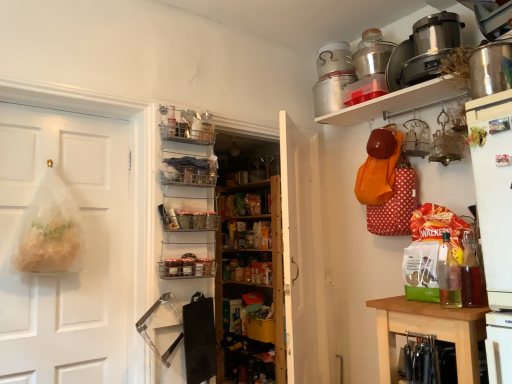
Locate an element on the screen. This screenshot has height=384, width=512. vacant space situated above metallic wire baskets at center, which is counted as the first shelf, starting from the top (from a real-world perspective) is located at coordinates (195, 201).